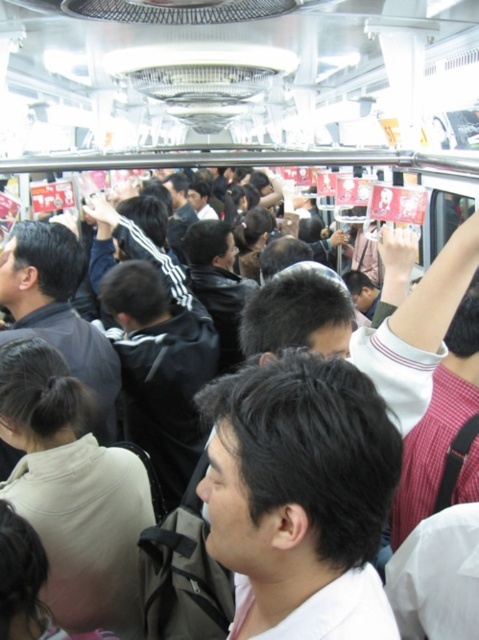
Who is more forward, (x=299, y=531) or (x=214, y=362)?

Point (x=299, y=531) is more forward.

Is black matte hair at center thinner than black matte jacket at center?

Correct, black matte hair at center's width is less than black matte jacket at center's.

Which is behind, point (376, 477) or point (152, 365)?

Positioned behind is point (152, 365).

The height and width of the screenshot is (640, 479). What are the coordinates of `black matte hair at center` in the screenshot? It's located at (300, 496).

Is black matte hair at center taller than dark gray jacket at center?

No.

Who is lower down, black matte hair at center or dark gray jacket at center?

Positioned lower is black matte hair at center.

Is point (292, 563) positioned behind point (45, 236)?

No, (292, 563) is in front of (45, 236).

Identify the location of black matte hair at center. This screenshot has width=479, height=640. (300, 496).

Can you confirm if black matte jacket at center is smaller than dark gray jacket at center?

No, black matte jacket at center is not smaller than dark gray jacket at center.

Between point (202, 330) and point (68, 353), which one is positioned behind?

Positioned behind is point (202, 330).

Between point (187, 477) and point (15, 259), which one is positioned behind?

The point (187, 477) is more distant.

Locate an element on the screen. The image size is (479, 640). black matte jacket at center is located at coordinates (159, 369).